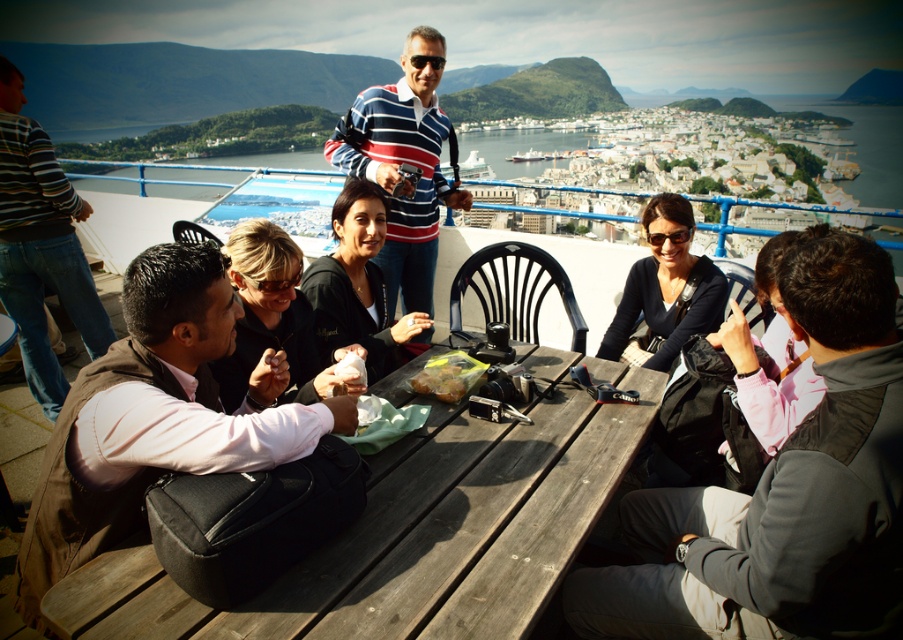
Question: Which point appears farthest from the camera in this image?

Choices:
 (A) (459, 396)
 (B) (72, 308)
 (C) (874, 321)

Answer: (B)

Question: Can you confirm if wooden picnic table at center is positioned above striped sweater at left?

Choices:
 (A) no
 (B) yes

Answer: (A)

Question: Does brown fabric vest at lower left have a greater width compared to matte black jacket at center?

Choices:
 (A) yes
 (B) no

Answer: (A)

Question: Estimate the real-world distances between objects in this image. Which object is farther from the matte black jacket at center?

Choices:
 (A) brown fabric vest at lower left
 (B) shiny plastic bag of food at center
 (C) striped sweater at left
 (D) wooden picnic table at center

Answer: (C)

Question: Can you confirm if pink fabric shirt at center is wider than black matte shirt at upper center?

Choices:
 (A) no
 (B) yes

Answer: (A)

Question: Which of these objects is positioned closest to the brown fabric vest at lower left?

Choices:
 (A) pink fabric shirt at center
 (B) wooden picnic table at center

Answer: (A)